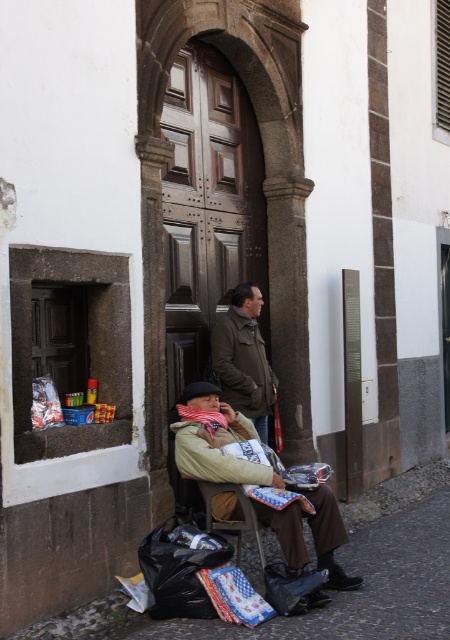
You are a pedestrian walking along the street and see the beige fabric jacket at lower center and the brown leather trench coat at center. Which one is located to the right of the other?

The beige fabric jacket at lower center is positioned on the right side of brown leather trench coat at center.

Based on the photo, you are a tailor who needs to determine if the beige fabric jacket at lower center can fit over the wooden chair at lower center. Based on the scene, can the jacket cover the chair completely?

The beige fabric jacket at lower center has a larger width than the wooden chair at lower center, so it is possible that the jacket can cover the chair completely.

You are a tailor observing the beige fabric jacket at lower center and the brown leather trench coat at center. Which garment has a longer length according to the description?

The brown leather trench coat at center is longer than the beige fabric jacket at lower center.